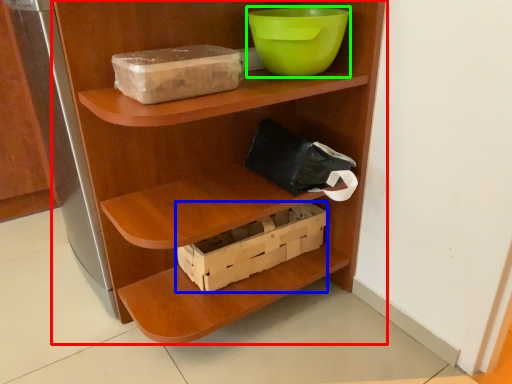
Question: Which object is the closest to the shelf (highlighted by a red box)? Choose among these: box (highlighted by a blue box) or bowl (highlighted by a green box).

Choices:
 (A) box
 (B) bowl

Answer: (A)